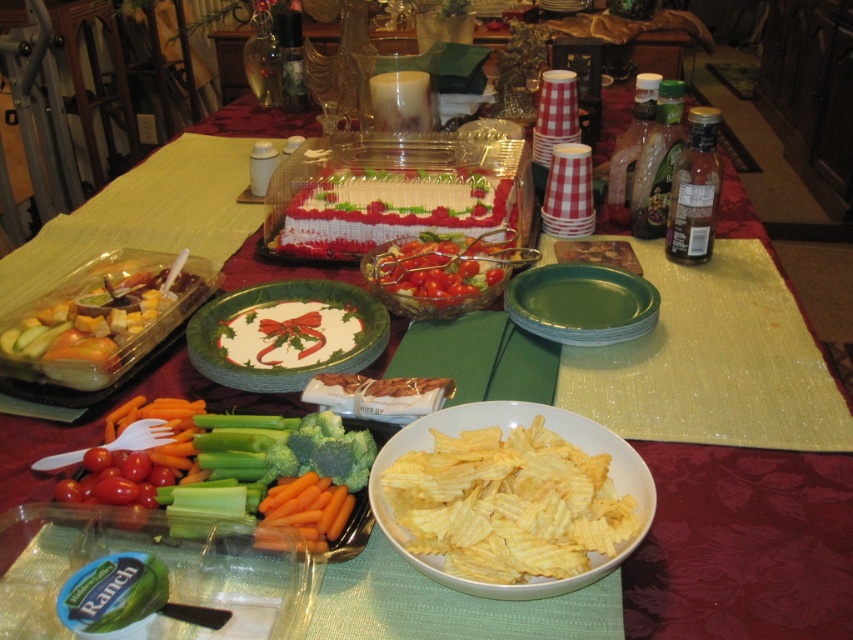
Is yellow crispy chips at center wider than white paper plate at center?

Incorrect, yellow crispy chips at center's width does not surpass white paper plate at center's.

Which is more to the right, yellow crispy chips at center or white paper plate at center?

From the viewer's perspective, yellow crispy chips at center appears more on the right side.

Between point (550, 445) and point (252, 371), which one is positioned behind?

The point (252, 371) is more distant.

You are a GUI agent. You are given a task and a screenshot of the screen. Output one action in this format:
    pyautogui.click(x=<x>, y=<y>)
    Task: Click on the yellow crispy chips at center
    This screenshot has height=640, width=853.
    Given the screenshot: What is the action you would take?
    [x=505, y=502]

Which is more to the left, green crisp celery at center or orange matte carrot at lower center?

Positioned to the left is green crisp celery at center.

Does point (341, 422) lie in front of point (329, 532)?

No, (341, 422) is further to viewer.

Which is behind, point (195, 458) or point (328, 483)?

The point (195, 458) is more distant.

Locate an element on the screen. green crisp celery at center is located at coordinates (294, 474).

Is green crisp celery at center shorter than translucent glass bowl at center?

Yes, green crisp celery at center is shorter than translucent glass bowl at center.

Does point (194, 512) lie behind point (444, 294)?

No, (194, 512) is closer to viewer.

Locate an element on the screen. Image resolution: width=853 pixels, height=640 pixels. green crisp celery at center is located at coordinates (294, 474).